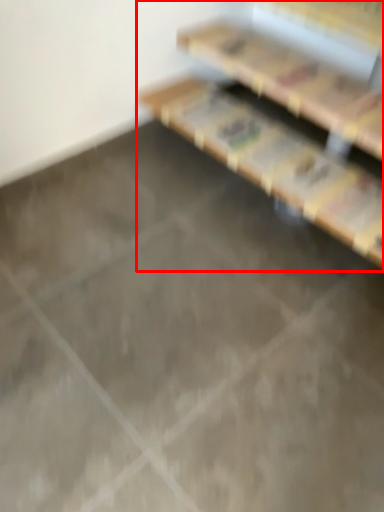
Question: From the image's perspective, considering the relative positions of furniture (annotated by the red box) and shelf in the image provided, where is furniture (annotated by the red box) located with respect to the staircase?

Choices:
 (A) above
 (B) below

Answer: (B)